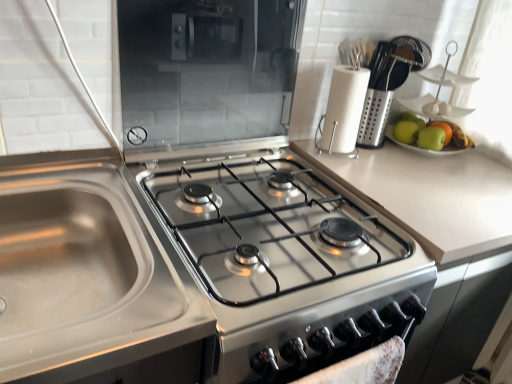
Question: From the image's perspective, is green matte apple at upper right, acting as the 2th apple starting from the right, above transparent glass microwave at upper center?

Choices:
 (A) no
 (B) yes

Answer: (A)

Question: Is green matte apple at upper right, acting as the 2th apple starting from the right, at the right side of transparent glass microwave at upper center?

Choices:
 (A) no
 (B) yes

Answer: (B)

Question: Is green matte apple at upper right, which appears as the second apple when viewed from the left, at the left side of transparent glass microwave at upper center?

Choices:
 (A) no
 (B) yes

Answer: (A)

Question: From a real-world perspective, does green matte apple at upper right, acting as the 2th apple starting from the right, sit lower than transparent glass microwave at upper center?

Choices:
 (A) yes
 (B) no

Answer: (A)

Question: Is green matte apple at upper right, acting as the 2th apple starting from the right, closer to the viewer compared to transparent glass microwave at upper center?

Choices:
 (A) no
 (B) yes

Answer: (A)

Question: Considering the relative sizes of green matte apple at upper right, which appears as the second apple when viewed from the left, and transparent glass microwave at upper center in the image provided, is green matte apple at upper right, which appears as the second apple when viewed from the left, wider than transparent glass microwave at upper center?

Choices:
 (A) yes
 (B) no

Answer: (A)

Question: Would you say green matte apple at right, which is the 3th apple in left-to-right order, is part of transparent glass microwave at upper center's contents?

Choices:
 (A) no
 (B) yes

Answer: (A)

Question: From a real-world perspective, is transparent glass microwave at upper center positioned over green matte apple at right, which is the 3th apple in left-to-right order, based on gravity?

Choices:
 (A) no
 (B) yes

Answer: (B)

Question: Is transparent glass microwave at upper center thinner than green matte apple at right, which is the 3th apple in left-to-right order?

Choices:
 (A) yes
 (B) no

Answer: (A)

Question: Considering the relative positions of transparent glass microwave at upper center and green matte apple at right, which is counted as the first apple, starting from the right, in the image provided, is transparent glass microwave at upper center behind green matte apple at right, which is counted as the first apple, starting from the right,?

Choices:
 (A) yes
 (B) no

Answer: (B)

Question: Is transparent glass microwave at upper center at the right side of green matte apple at right, which is counted as the first apple, starting from the right?

Choices:
 (A) yes
 (B) no

Answer: (B)

Question: From a real-world perspective, is transparent glass microwave at upper center under green matte apple at right, which is the 3th apple in left-to-right order?

Choices:
 (A) yes
 (B) no

Answer: (B)

Question: Can you confirm if stainless steel gas stove at center is bigger than transparent glass microwave at upper center?

Choices:
 (A) no
 (B) yes

Answer: (B)